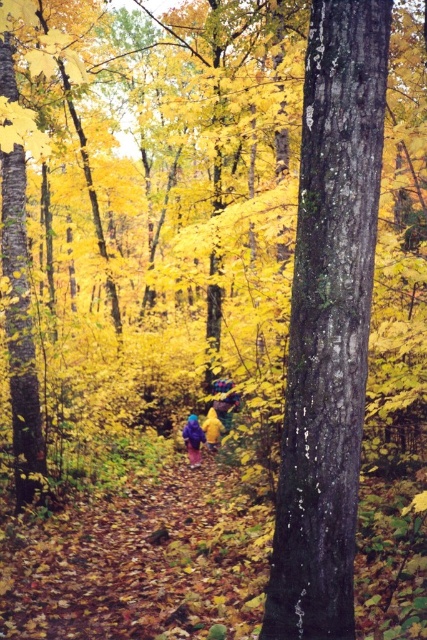
Question: Which object is farther from the camera taking this photo?

Choices:
 (A) smooth dark bark tree at center
 (B) raincoat at center
 (C) yellow fabric at center

Answer: (C)

Question: Which point is closer to the camera?

Choices:
 (A) (365, 333)
 (B) (207, 428)

Answer: (A)

Question: Is smooth dark bark tree at center wider than raincoat at center?

Choices:
 (A) no
 (B) yes

Answer: (B)

Question: Estimate the real-world distances between objects in this image. Which object is closer to the yellow fabric at center?

Choices:
 (A) raincoat at center
 (B) smooth dark bark tree at center

Answer: (A)

Question: Does raincoat at center appear over yellow fabric at center?

Choices:
 (A) no
 (B) yes

Answer: (A)

Question: Is smooth dark bark tree at center above raincoat at center?

Choices:
 (A) yes
 (B) no

Answer: (A)